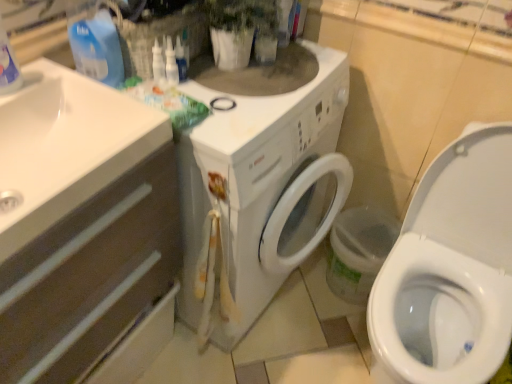
Question: Does blue plastic bottle at upper left have a greater width compared to white matte drawer at left?

Choices:
 (A) no
 (B) yes

Answer: (A)

Question: Is blue plastic bottle at upper left with white matte drawer at left?

Choices:
 (A) no
 (B) yes

Answer: (A)

Question: Is blue plastic bottle at upper left bigger than white matte drawer at left?

Choices:
 (A) no
 (B) yes

Answer: (A)

Question: Would you say blue plastic bottle at upper left is outside white matte drawer at left?

Choices:
 (A) no
 (B) yes

Answer: (B)

Question: Is white matte drawer at left at the back of blue plastic bottle at upper left?

Choices:
 (A) yes
 (B) no

Answer: (B)

Question: From the image's perspective, relative to white glossy sink at left, is blue plastic bottle at upper left above or below?

Choices:
 (A) below
 (B) above

Answer: (B)

Question: Is blue plastic bottle at upper left inside or outside of white glossy sink at left?

Choices:
 (A) outside
 (B) inside

Answer: (A)

Question: Is blue plastic bottle at upper left bigger or smaller than white glossy sink at left?

Choices:
 (A) small
 (B) big

Answer: (A)

Question: Is blue plastic bottle at upper left taller or shorter than white glossy sink at left?

Choices:
 (A) tall
 (B) short

Answer: (A)

Question: From a real-world perspective, relative to blue plastic bottle at upper left, is white matte drawer at left vertically above or below?

Choices:
 (A) above
 (B) below

Answer: (B)

Question: Relative to blue plastic bottle at upper left, is white matte drawer at left in front or behind?

Choices:
 (A) behind
 (B) front

Answer: (B)

Question: Considering the relative positions of white matte drawer at left and blue plastic bottle at upper left in the image provided, is white matte drawer at left to the left or to the right of blue plastic bottle at upper left?

Choices:
 (A) left
 (B) right

Answer: (A)

Question: Looking at their shapes, would you say white matte drawer at left is wider or thinner than blue plastic bottle at upper left?

Choices:
 (A) thin
 (B) wide

Answer: (B)

Question: Relative to white glossy sink at left, is white matte drawer at left in front or behind?

Choices:
 (A) behind
 (B) front

Answer: (B)

Question: From a real-world perspective, is white matte drawer at left above or below white glossy sink at left?

Choices:
 (A) below
 (B) above

Answer: (A)